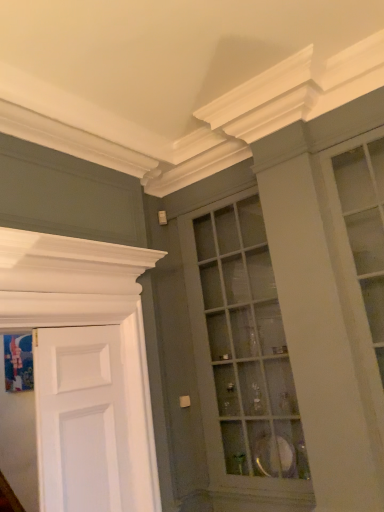
Question: From a real-world perspective, is white matte door at left positioned above or below matte glass cabinet at center?

Choices:
 (A) above
 (B) below

Answer: (B)

Question: Does point (92, 330) appear closer or farther from the camera than point (221, 224)?

Choices:
 (A) farther
 (B) closer

Answer: (B)

Question: Is white matte door at left taller or shorter than matte glass cabinet at center?

Choices:
 (A) tall
 (B) short

Answer: (B)

Question: From a real-world perspective, is matte glass cabinet at center physically located above or below white matte door at left?

Choices:
 (A) below
 (B) above

Answer: (B)

Question: In terms of width, does matte glass cabinet at center look wider or thinner when compared to white matte door at left?

Choices:
 (A) wide
 (B) thin

Answer: (A)

Question: Is matte glass cabinet at center situated inside white matte door at left or outside?

Choices:
 (A) outside
 (B) inside

Answer: (A)

Question: Is matte glass cabinet at center to the left or to the right of white matte door at left in the image?

Choices:
 (A) left
 (B) right

Answer: (B)